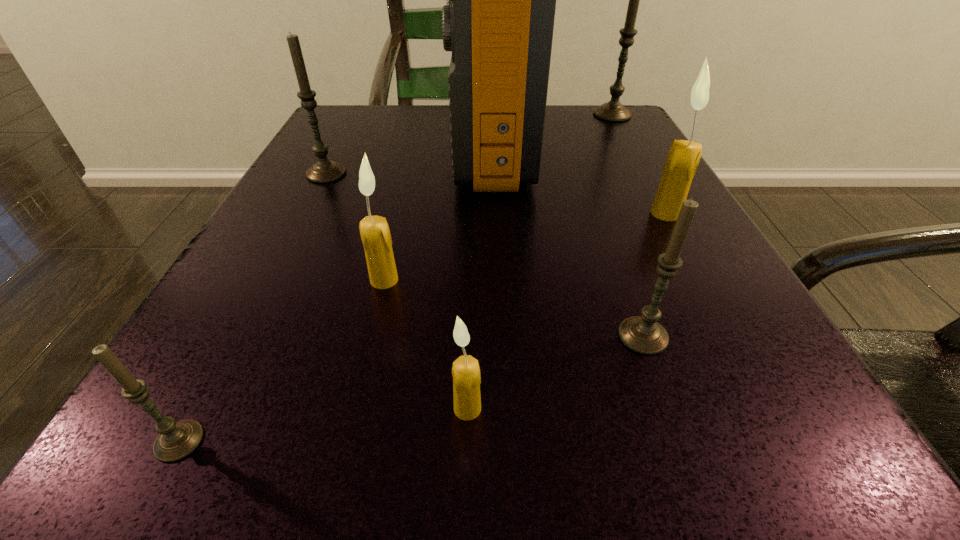
Where is `the closest gray candle to the farthest gray candle`? the closest gray candle to the farthest gray candle is located at coordinates (324, 171).

Identify which cream candle is located as the second nearest to the seventh shortest object. Please provide its 2D coordinates. Your answer should be formatted as a tuple, i.e. [(x, y)], where the tuple contains the x and y coordinates of a point satisfying the conditions above.

[(374, 230)]

Select which cream candle appears as the closest to the farthest gray candle. Please provide its 2D coordinates. Your answer should be formatted as a tuple, i.e. [(x, y)], where the tuple contains the x and y coordinates of a point satisfying the conditions above.

[(683, 158)]

Locate an element on the screen. The width and height of the screenshot is (960, 540). vacant region that satisfies the following two spatial constraints: 1. on the back side of the third nearest object; 2. on the front-facing side of the tallest object is located at coordinates (576, 148).

Locate an element on the screen. This screenshot has width=960, height=540. free space that satisfies the following two spatial constraints: 1. on the front-facing side of the tallest object; 2. on the left side of the fifth nearest candle is located at coordinates (494, 213).

Find the location of `free point that satisfies the following two spatial constraints: 1. on the front side of the third nearest gray candle; 2. on the right side of the second smallest gray candle`. free point that satisfies the following two spatial constraints: 1. on the front side of the third nearest gray candle; 2. on the right side of the second smallest gray candle is located at coordinates pos(242,336).